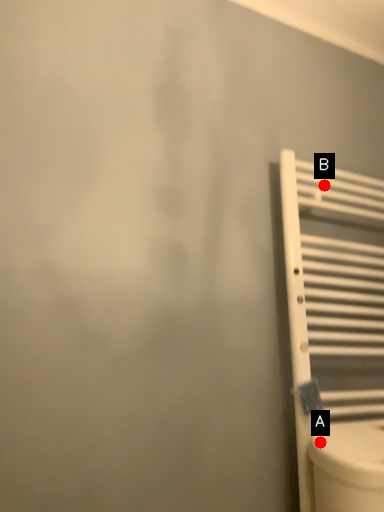
Question: Two points are circled on the image, labeled by A and B beside each circle. Among these points, which one is nearest to the camera?

Choices:
 (A) A is closer
 (B) B is closer

Answer: (A)